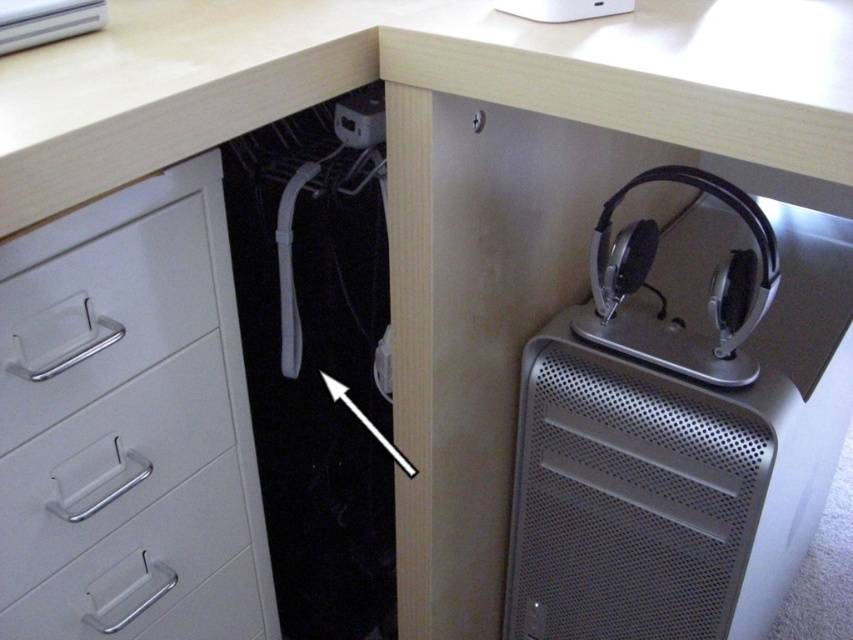
You are organizing your desk and want to place a new decorative item between the white plastic file cabinet at left and the metallic arrow at center. Based on their widths, which object should you consider moving to make space?

The white plastic file cabinet at left is wider than the metallic arrow at center. To make space for the new decorative item, you should consider moving the white plastic file cabinet at left since it occupies more width.

You are setting up a new monitor on your desk and need to know where to place it. The monitor requires a space that is not occupied by the white plastic file cabinet at left. Based on the desk setup described, where should you place the monitor?

The white plastic file cabinet at left is located at point [128,424], so you should place the monitor in an area of the desk that is not at that coordinate to avoid occupying the cabinet space.

You are organizing your desk and want to place a new folder into the correct drawer. The metallic arrow at center is pointing towards the white plastic file cabinet at left. Which direction should you move the folder to reach the cabinet?

The white plastic file cabinet at left is positioned under the metallic arrow at center, so you should move the folder towards the left to reach the cabinet.